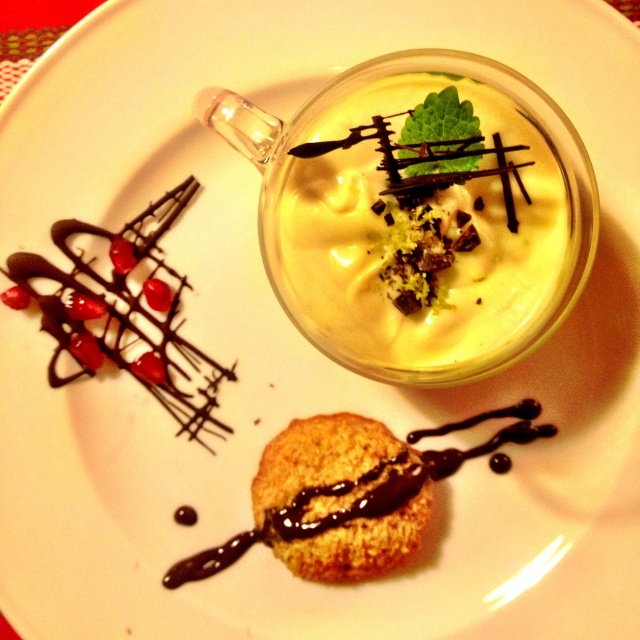
This screenshot has height=640, width=640. Find the location of `yellow creamy pudding at center`. yellow creamy pudding at center is located at coordinates (422, 224).

Where is `yellow creamy pudding at center`? This screenshot has height=640, width=640. yellow creamy pudding at center is located at coordinates (422, 224).

Identify the location of yellow creamy pudding at center. The height and width of the screenshot is (640, 640). (422, 224).